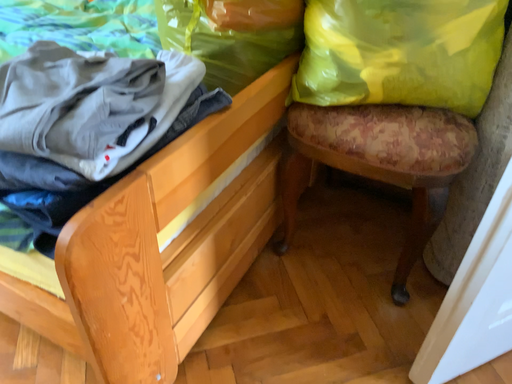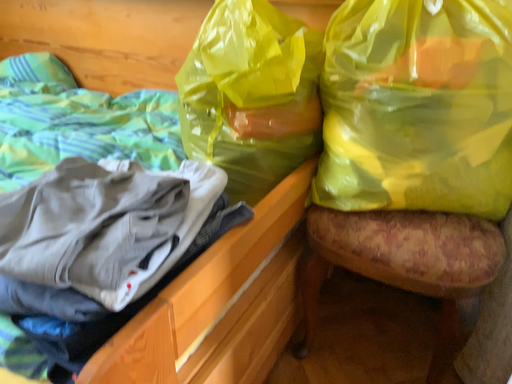
Question: Which way did the camera rotate in the video?

Choices:
 (A) rotated upward
 (B) rotated downward

Answer: (A)